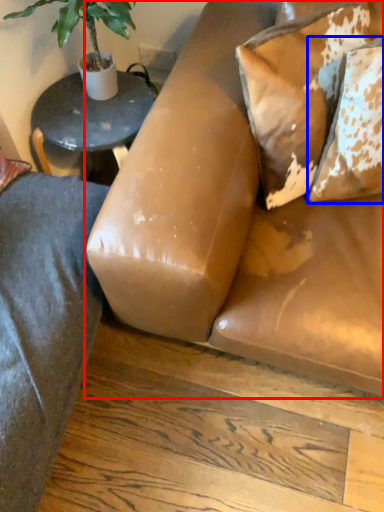
Question: Which point is further to the camera, studio couch (highlighted by a red box) or pillow (highlighted by a blue box)?

Choices:
 (A) studio couch
 (B) pillow

Answer: (B)